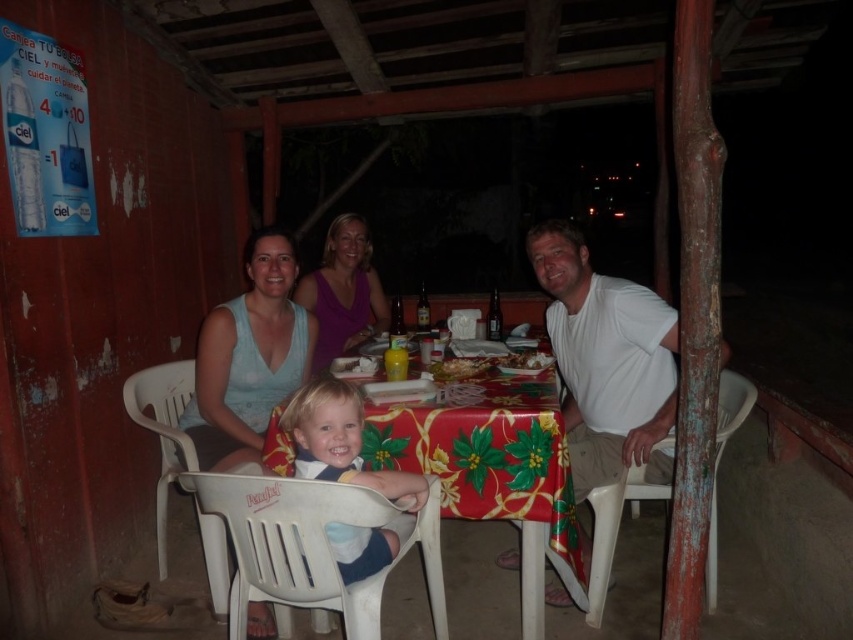
Does light blue fabric dress at center have a greater height compared to matte purple tank top at center?

Indeed, light blue fabric dress at center has a greater height compared to matte purple tank top at center.

Measure the distance from light blue fabric dress at center to matte purple tank top at center.

light blue fabric dress at center and matte purple tank top at center are 55.56 centimeters apart.

Does point (234, 324) come behind point (334, 259)?

No, (234, 324) is in front of (334, 259).

Locate an element on the screen. This screenshot has height=640, width=853. light blue fabric dress at center is located at coordinates (248, 356).

Looking at this image, does white cotton shirt at right have a larger size compared to golden brown pastry at center?

Correct, white cotton shirt at right is larger in size than golden brown pastry at center.

Is point (544, 276) closer to viewer compared to point (448, 378)?

No, it is behind (448, 378).

I want to click on white cotton shirt at right, so click(606, 360).

Which is in front, point (438, 369) or point (521, 362)?

Positioned in front is point (438, 369).

Is point (447, 356) positioned before point (502, 358)?

No, (447, 356) is further to viewer.

You are a GUI agent. You are given a task and a screenshot of the screen. Output one action in this format:
    pyautogui.click(x=<x>, y=<y>)
    Task: Click on the floral tablecloth at center
    The width and height of the screenshot is (853, 640).
    Given the screenshot: What is the action you would take?
    pyautogui.click(x=453, y=372)